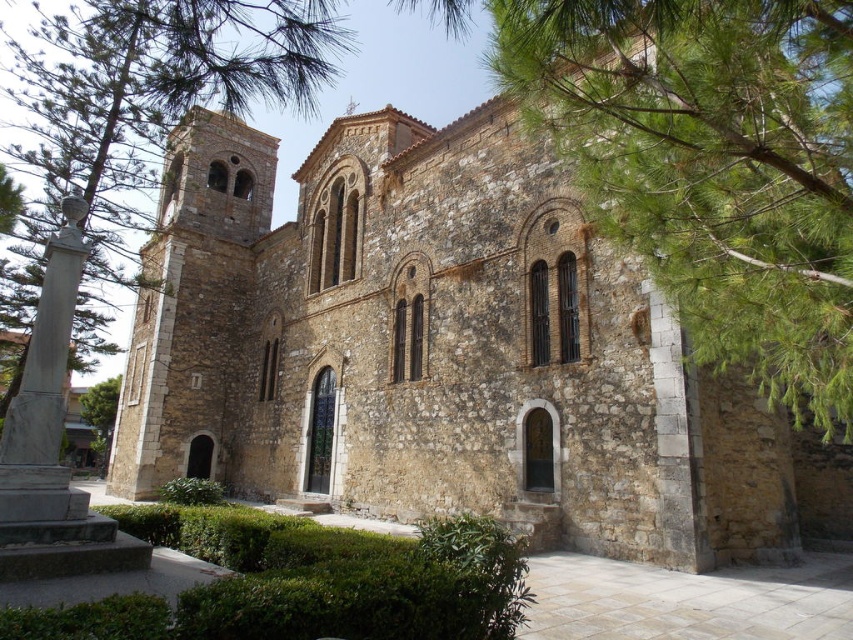
You are an architect visiting a historic site and need to determine the spatial relationship between the brown stone church at center and the gray marble bust at left. Which object is wider?

The brown stone church at center is wider than the gray marble bust at left.

You are standing at point A, which is at coordinates (442, 353). What is the most prominent structure visible from this point?

The most prominent structure visible from point A at coordinates (442, 353) is the brown stone church at center.